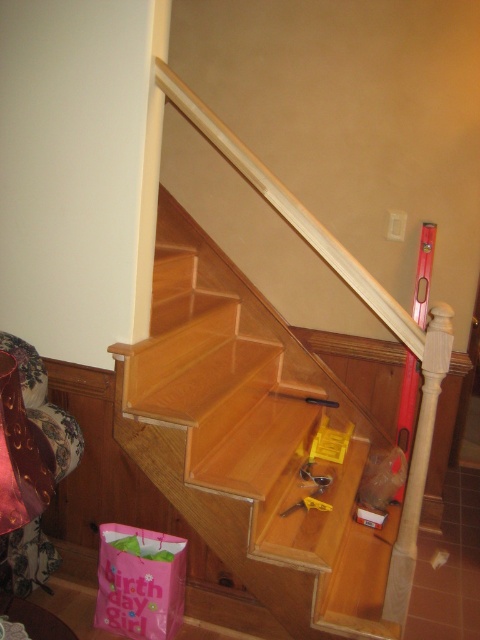
Question: Is wooden at upper center positioned in front of yellow plastic tool at center?

Choices:
 (A) yes
 (B) no

Answer: (A)

Question: Is wooden at upper center smaller than yellow plastic tool at center?

Choices:
 (A) no
 (B) yes

Answer: (A)

Question: In this image, where is wooden at upper center located relative to yellow plastic tool at center?

Choices:
 (A) left
 (B) right

Answer: (B)

Question: Among these objects, which one is farthest from the camera?

Choices:
 (A) wooden at upper center
 (B) yellow plastic tool at center

Answer: (B)